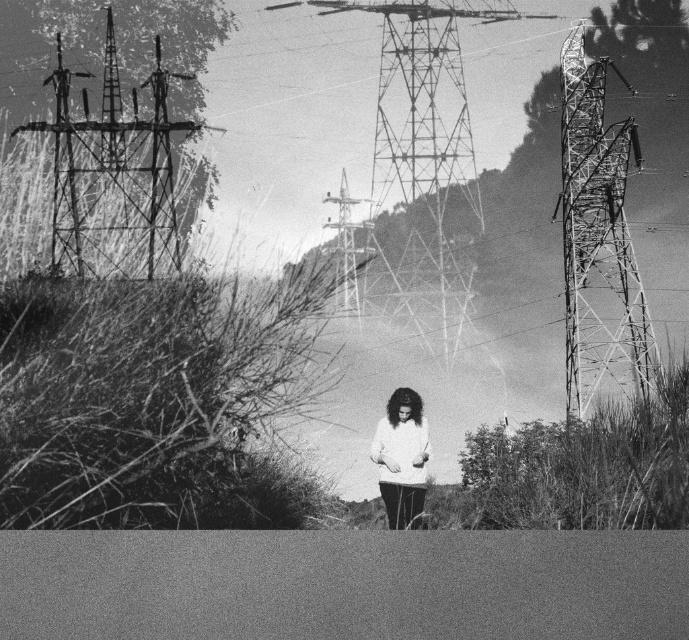
Is metallic grid structure at left wider than white matte sweater at center?

Yes, metallic grid structure at left is wider than white matte sweater at center.

Does point (114, 259) lie behind point (384, 456)?

Yes, point (114, 259) is farther from viewer.

I want to click on metallic grid structure at left, so click(113, 173).

You are a GUI agent. You are given a task and a screenshot of the screen. Output one action in this format:
    pyautogui.click(x=<x>, y=<y>)
    Task: Click on the metallic grid structure at left
    
    Given the screenshot: What is the action you would take?
    pyautogui.click(x=113, y=173)

Is metallic grid structure at left to the left of metallic tower at center from the viewer's perspective?

Indeed, metallic grid structure at left is positioned on the left side of metallic tower at center.

Between metallic grid structure at left and metallic tower at center, which one has less height?

metallic tower at center

Where is `metallic grid structure at left`? The height and width of the screenshot is (640, 689). metallic grid structure at left is located at coordinates (113, 173).

The width and height of the screenshot is (689, 640). Identify the location of metallic grid structure at left. (113, 173).

Who is lower down, white matte sweater at center or metallic tower at center?

white matte sweater at center is lower down.

In the scene shown: Can you confirm if white matte sweater at center is positioned below metallic tower at center?

Indeed, white matte sweater at center is positioned under metallic tower at center.

This screenshot has width=689, height=640. I want to click on white matte sweater at center, so click(x=401, y=458).